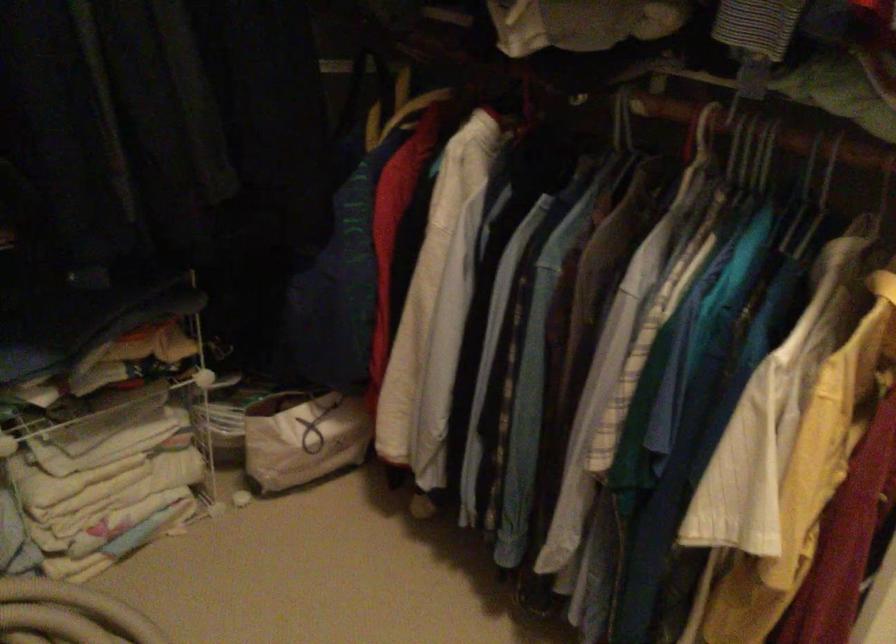
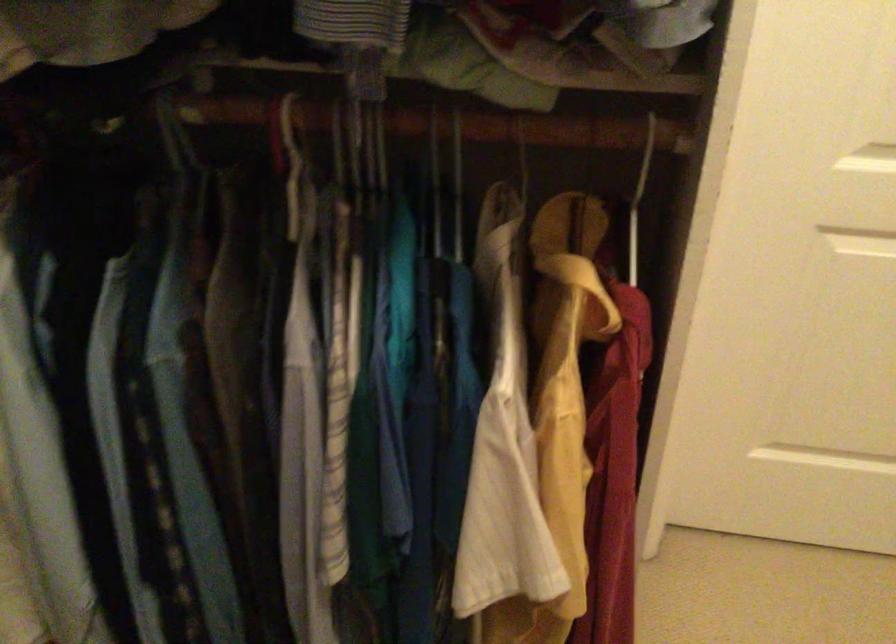
The point at (767, 154) is marked in the first image. Where is the corresponding point in the second image?

(383, 144)